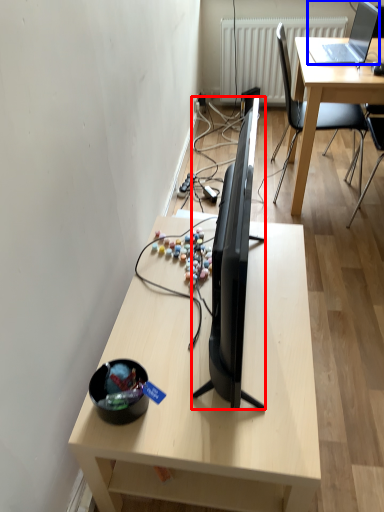
Question: Among these objects, which one is nearest to the camera, television (highlighted by a red box) or laptop (highlighted by a blue box)?

Choices:
 (A) television
 (B) laptop

Answer: (A)